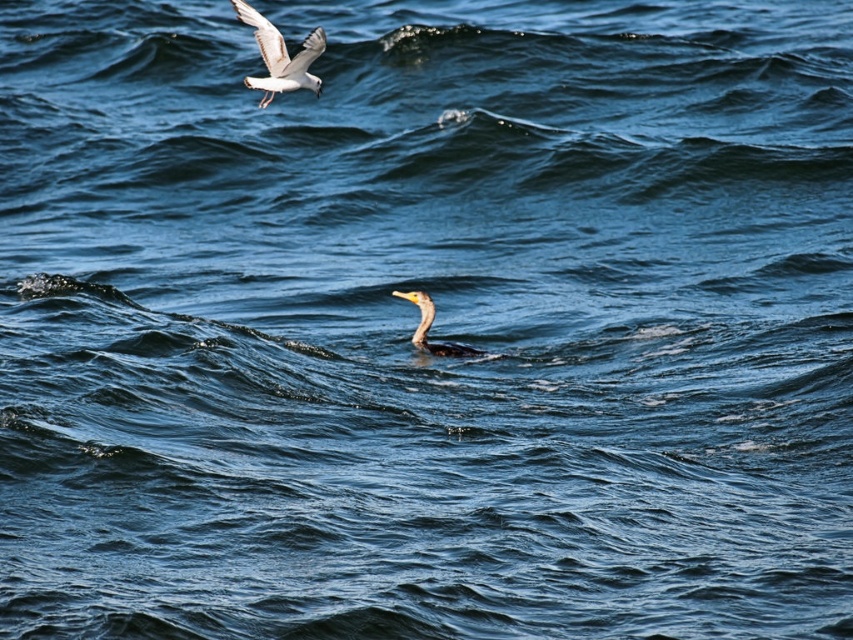
Based on the scene, where is the white feathered bird at upper left located in terms of its 2D coordinates?

The white feathered bird at upper left is located at the 2D coordinates of point (280, 56).

Consider the image. You are a photographer trying to capture both the white feathered bird at upper left and the shiny black duck at center in your shot. Which bird will appear larger in your photo?

The white feathered bird at upper left is much taller than the shiny black duck at center, so it will appear larger in the photo.

You are a photographer trying to capture a photo of the white feathered bird at upper left and the shiny black duck at center. Which bird is further to the left in the image?

The white feathered bird at upper left is further to the left in the image because it is positioned on the left side of the shiny black duck at center.